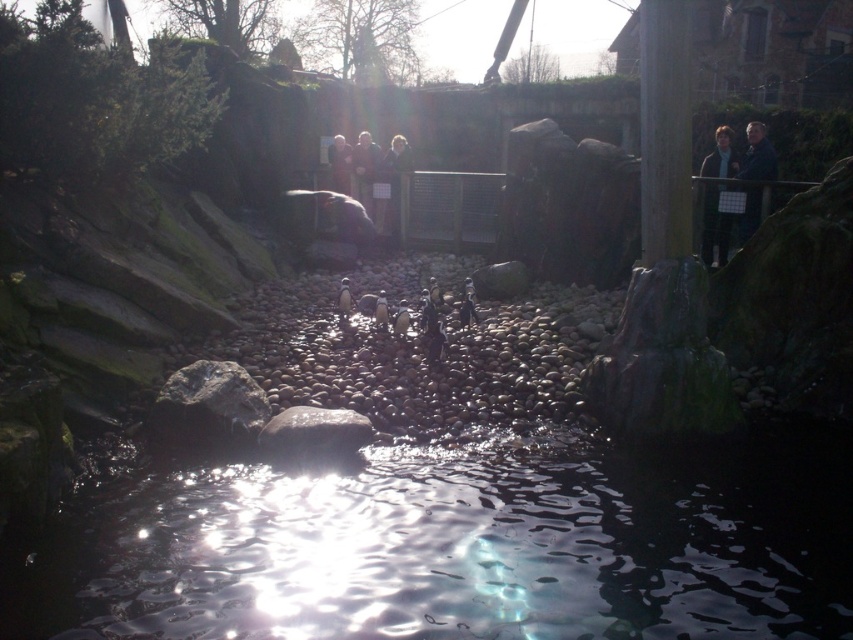
Is dark blue sweater at upper right bigger than dark brown fur at center?

No.

Which of these two, dark blue sweater at upper right or dark brown fur at center, stands taller?

With more height is dark brown fur at center.

Where is `dark blue sweater at upper right`? dark blue sweater at upper right is located at coordinates (714, 227).

Find the location of a particular element. dark blue sweater at upper right is located at coordinates (714, 227).

Is the position of transparent water at center less distant than that of dark blue sweater at upper right?

That is True.

Find the location of `transparent water at center`. transparent water at center is located at coordinates (x=459, y=547).

Is dark brown fur at center to the left of smooth skin person at center from the viewer's perspective?

Incorrect, dark brown fur at center is not on the left side of smooth skin person at center.

Between dark brown fur at center and smooth skin person at center, which one has less height?

smooth skin person at center

Is point (374, 157) positioned behind point (340, 186)?

No, it is not.

Identify the location of dark brown fur at center. (364, 170).